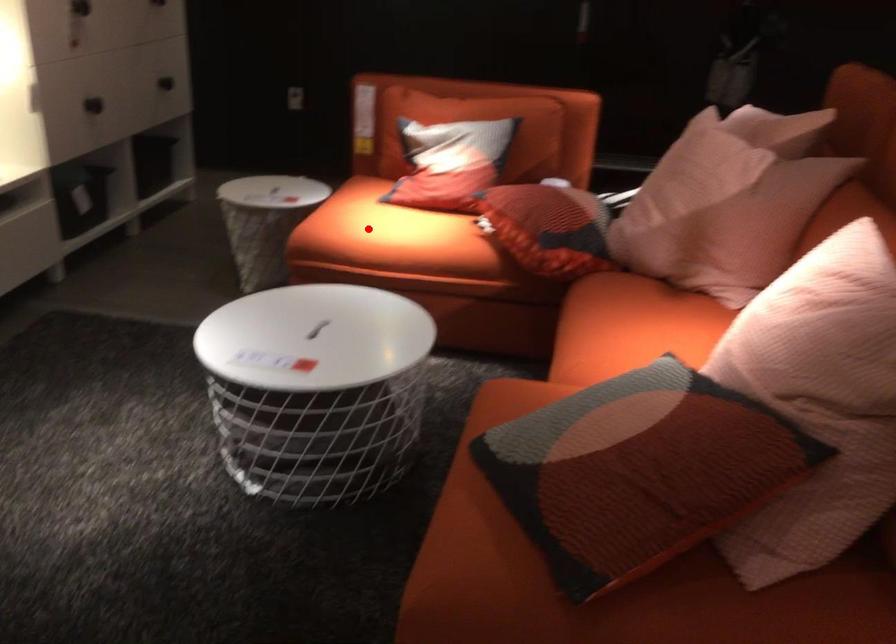
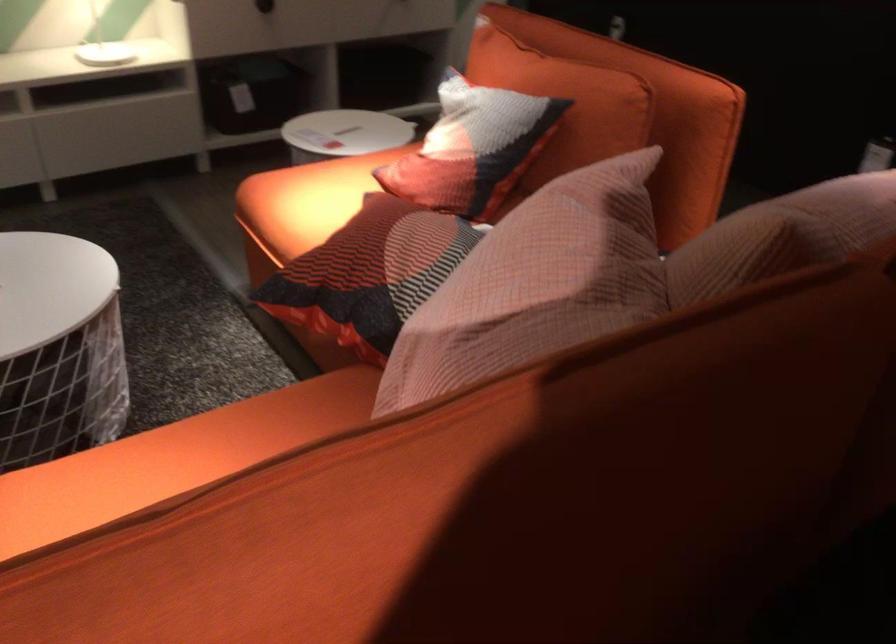
In the second image, find the point that corresponds to the highlighted location in the first image.

(306, 200)